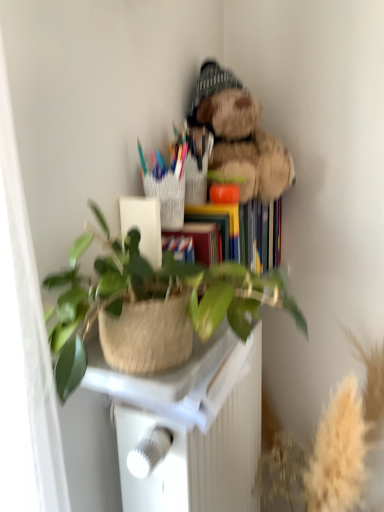
Question: Considering their positions, is green woven basket at center located in front of or behind fuzzy brown teddy bear at upper right?

Choices:
 (A) front
 (B) behind

Answer: (A)

Question: Would you say green woven basket at center is to the left or to the right of fuzzy brown teddy bear at upper right in the picture?

Choices:
 (A) left
 (B) right

Answer: (A)

Question: Which of these objects is positioned farthest from the fuzzy brown teddy bear at upper right?

Choices:
 (A) green woven basket at center
 (B) white plastic table at center

Answer: (B)

Question: Based on their relative distances, which object is farther from the green woven basket at center?

Choices:
 (A) fuzzy brown teddy bear at upper right
 (B) white plastic table at center

Answer: (A)